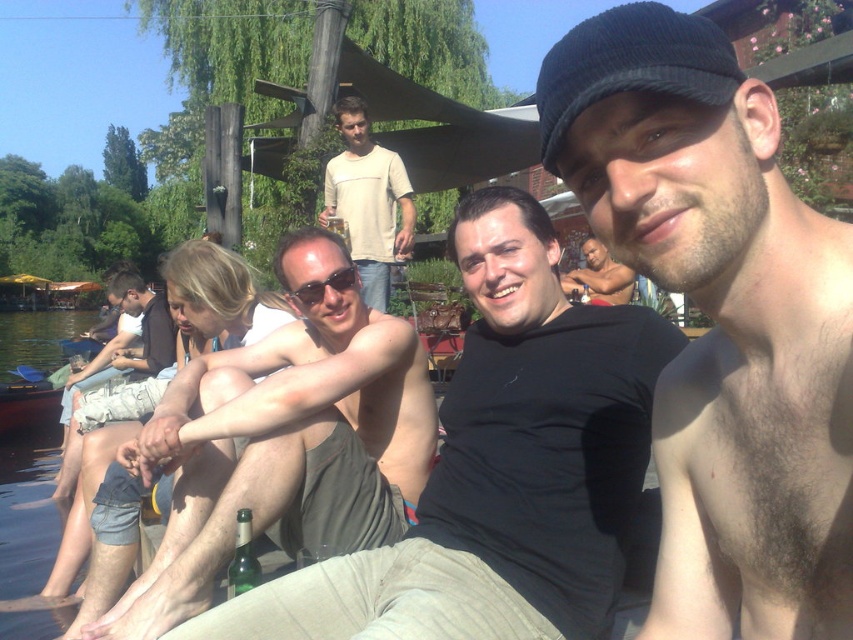
Does shiny black skin at center have a smaller size compared to clear water at lower left?

Yes, shiny black skin at center is smaller than clear water at lower left.

Which is in front, point (840, 284) or point (47, 320)?

Point (840, 284) is in front.

Between point (705, 45) and point (62, 353), which one is positioned in front?

Point (705, 45) is in front.

At what (x,y) coordinates should I click in order to perform the action: click on shiny black skin at center. Please return your answer as a coordinate pair (x, y). The width and height of the screenshot is (853, 640). Looking at the image, I should click on (720, 321).

Is shiny skin at center above light beige cotton shirt at center?

Incorrect, shiny skin at center is not positioned above light beige cotton shirt at center.

Between point (440, 584) and point (375, 156), which one is positioned behind?

Positioned behind is point (375, 156).

At what (x,y) coordinates should I click in order to perform the action: click on shiny skin at center. Please return your answer as a coordinate pair (x, y). Looking at the image, I should click on pos(500,467).

Who is positioned more to the right, shiny black skin at center or tan skin shirtless man at center?

From the viewer's perspective, shiny black skin at center appears more on the right side.

What do you see at coordinates (720, 321) in the screenshot? I see `shiny black skin at center` at bounding box center [720, 321].

You are a GUI agent. You are given a task and a screenshot of the screen. Output one action in this format:
    pyautogui.click(x=<x>, y=<y>)
    Task: Click on the shiny black skin at center
    The height and width of the screenshot is (640, 853).
    Given the screenshot: What is the action you would take?
    pyautogui.click(x=720, y=321)